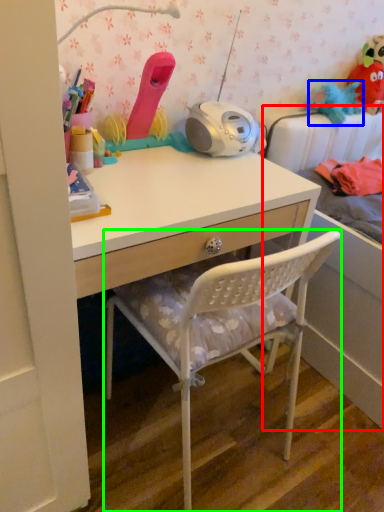
Question: Estimate the real-world distances between objects in this image. Which object is farther from bed (highlighted by a red box), toy (highlighted by a blue box) or chair (highlighted by a green box)?

Choices:
 (A) toy
 (B) chair

Answer: (A)